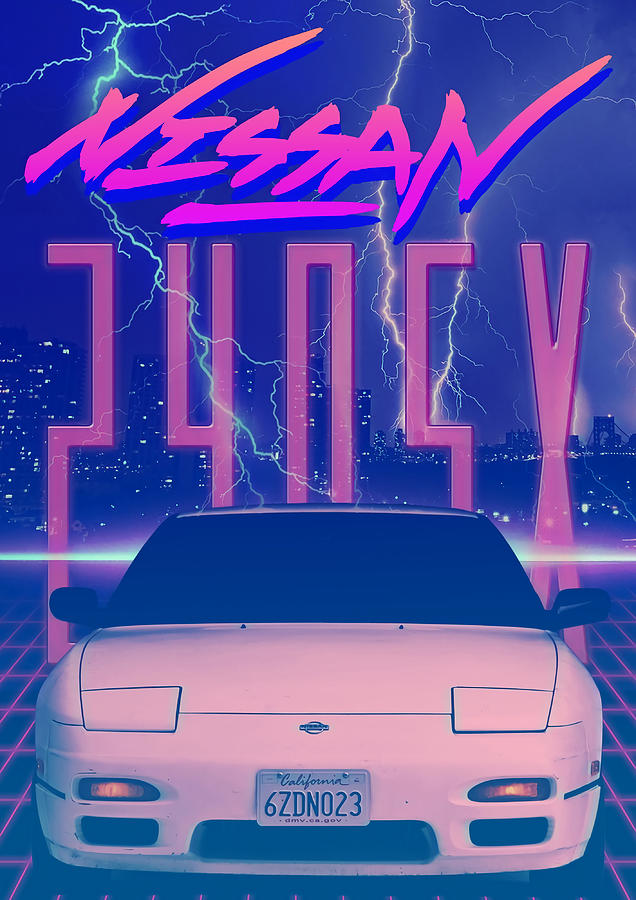
Where is `lights on ground`? Image resolution: width=636 pixels, height=900 pixels. lights on ground is located at coordinates (618, 672), (18, 729).